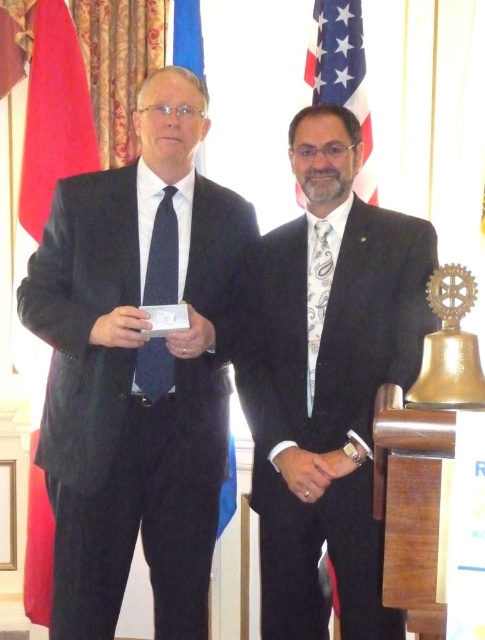
Who is more forward, (355,17) or (156,362)?

Point (156,362)

Based on the photo, is american flag at upper center behind matte black tie at left?

Yes, it is.

Which is behind, point (351, 54) or point (143, 349)?

The point (351, 54) is more distant.

Locate an element on the screen. american flag at upper center is located at coordinates (341, 74).

Who is shorter, matte black suit at center or american flag at upper center?

With less height is american flag at upper center.

Can you confirm if matte black suit at center is wider than american flag at upper center?

Yes.

What do you see at coordinates (327, 380) in the screenshot?
I see `matte black suit at center` at bounding box center [327, 380].

Where is `matte black suit at center`? matte black suit at center is located at coordinates (327, 380).

Which is above, red fabric flag at left or american flag at upper center?

american flag at upper center is above.

Does red fabric flag at left have a lesser width compared to american flag at upper center?

Incorrect, red fabric flag at left's width is not less than american flag at upper center's.

Which is behind, point (49, 609) or point (316, 1)?

The point (316, 1) is more distant.

Image resolution: width=485 pixels, height=640 pixels. In order to click on red fabric flag at left in this screenshot , I will do `click(51, 122)`.